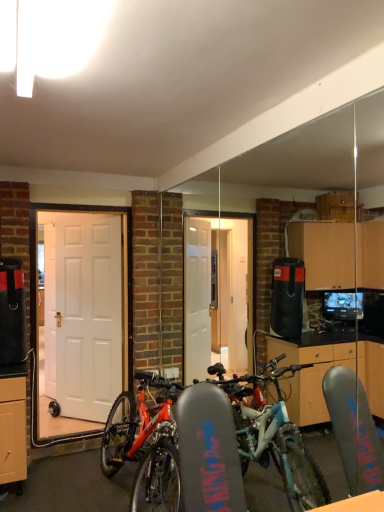
At what (x,y) coordinates should I click in order to perform the action: click on white matte door at left, the 1th door from the left. Please return your answer as a coordinate pair (x, y). Image resolution: width=384 pixels, height=512 pixels. Looking at the image, I should click on (50, 308).

Looking at this image, measure the distance between white matte door at left, the 1th door from the left, and camera.

Answer: They are 4.20 meters apart.

Image resolution: width=384 pixels, height=512 pixels. What do you see at coordinates (50, 308) in the screenshot?
I see `white matte door at left, the second door positioned from the right` at bounding box center [50, 308].

What is the approximate height of white glossy door at center, which ranks as the first door in right-to-left order?

2.00 meters.

Image resolution: width=384 pixels, height=512 pixels. What do you see at coordinates (87, 309) in the screenshot? I see `white glossy door at center, marked as the 1th door in a front-to-back arrangement` at bounding box center [87, 309].

In order to click on white glossy door at center, which ranks as the first door in right-to-left order in this screenshot , I will do `click(87, 309)`.

You are a GUI agent. You are given a task and a screenshot of the screen. Output one action in this format:
    pyautogui.click(x=<x>, y=<y>)
    Task: Click on the white matte door at left, the 1th door from the left
    Image resolution: width=384 pixels, height=512 pixels.
    Given the screenshot: What is the action you would take?
    50,308

Is white matte door at left, marked as the 2th door in a front-to-back arrangement, at the left side of white glossy door at center, the 2th door viewed from the back?

Yes.

Which object is further away from the camera taking this photo, white matte door at left, the second door positioned from the right, or white glossy door at center, the second door from the left?

white matte door at left, the second door positioned from the right.

Is point (51, 224) farther from camera compared to point (86, 378)?

Yes, it is behind point (86, 378).

From the image's perspective, is white matte door at left, marked as the 2th door in a front-to-back arrangement, above white glossy door at center, which ranks as the first door in right-to-left order?

No, from the image's perspective, white matte door at left, marked as the 2th door in a front-to-back arrangement, is not above white glossy door at center, which ranks as the first door in right-to-left order.

From a real-world perspective, is white matte door at left, arranged as the 1th door when viewed from the back, positioned above or below white glossy door at center, the second door from the left?

white matte door at left, arranged as the 1th door when viewed from the back, is situated lower than white glossy door at center, the second door from the left, in the real world.

Is white matte door at left, the second door positioned from the right, wider or thinner than white glossy door at center, marked as the 1th door in a front-to-back arrangement?

In the image, white matte door at left, the second door positioned from the right, appears to be more narrow than white glossy door at center, marked as the 1th door in a front-to-back arrangement.

Between white matte door at left, marked as the 2th door in a front-to-back arrangement, and white glossy door at center, the 2th door viewed from the back, which one has less height?

With less height is white matte door at left, marked as the 2th door in a front-to-back arrangement.

Based on their sizes in the image, would you say white matte door at left, the 1th door from the left, is bigger or smaller than white glossy door at center, the 2th door viewed from the back?

Clearly, white matte door at left, the 1th door from the left, is smaller in size than white glossy door at center, the 2th door viewed from the back.

Is white matte door at left, the 1th door from the left, located outside white glossy door at center, which ranks as the first door in right-to-left order?

Yes, white matte door at left, the 1th door from the left, is outside of white glossy door at center, which ranks as the first door in right-to-left order.

Is white matte door at left, the 1th door from the left, beside white glossy door at center, the second door from the left?

No, white matte door at left, the 1th door from the left, is not touching white glossy door at center, the second door from the left.

Is white matte door at left, arranged as the 1th door when viewed from the back, positioned with its back to white glossy door at center, which ranks as the first door in right-to-left order?

white matte door at left, arranged as the 1th door when viewed from the back, does not have its back to white glossy door at center, which ranks as the first door in right-to-left order.

How different are the orientations of white matte door at left, the second door positioned from the right, and white glossy door at center, the second door from the left, in degrees?

The angle between the facing direction of white matte door at left, the second door positioned from the right, and the facing direction of white glossy door at center, the second door from the left, is 15.6 degrees.

The width and height of the screenshot is (384, 512). Find the location of `door lying on the right of white matte door at left, marked as the 2th door in a front-to-back arrangement`. door lying on the right of white matte door at left, marked as the 2th door in a front-to-back arrangement is located at coordinates (87, 309).

Considering the positions of objects white glossy door at center, the second door from the left, and white matte door at left, the 1th door from the left, in the image provided, who is more to the right, white glossy door at center, the second door from the left, or white matte door at left, the 1th door from the left,?

white glossy door at center, the second door from the left, is more to the right.

Considering the positions of objects white glossy door at center, the second door from the left, and white matte door at left, arranged as the 1th door when viewed from the back, in the image provided, who is in front, white glossy door at center, the second door from the left, or white matte door at left, arranged as the 1th door when viewed from the back,?

Positioned in front is white glossy door at center, the second door from the left.

Is point (59, 382) closer or farther from the camera than point (44, 237)?

Point (59, 382) is closer to the camera than point (44, 237).

From the image's perspective, is white glossy door at center, which ranks as the first door in right-to-left order, above or below white matte door at left, marked as the 2th door in a front-to-back arrangement?

white glossy door at center, which ranks as the first door in right-to-left order, is situated higher than white matte door at left, marked as the 2th door in a front-to-back arrangement, in the image.

From a real-world perspective, is white glossy door at center, marked as the 1th door in a front-to-back arrangement, on top of white matte door at left, arranged as the 1th door when viewed from the back?

Yes, from a real-world perspective, white glossy door at center, marked as the 1th door in a front-to-back arrangement, is above white matte door at left, arranged as the 1th door when viewed from the back.

Can you confirm if white glossy door at center, which ranks as the first door in right-to-left order, is wider than white matte door at left, the second door positioned from the right?

Correct, the width of white glossy door at center, which ranks as the first door in right-to-left order, exceeds that of white matte door at left, the second door positioned from the right.

Who is shorter, white glossy door at center, marked as the 1th door in a front-to-back arrangement, or white matte door at left, arranged as the 1th door when viewed from the back?

white matte door at left, arranged as the 1th door when viewed from the back.

Considering the sizes of objects white glossy door at center, which ranks as the first door in right-to-left order, and white matte door at left, marked as the 2th door in a front-to-back arrangement, in the image provided, who is bigger, white glossy door at center, which ranks as the first door in right-to-left order, or white matte door at left, marked as the 2th door in a front-to-back arrangement,?

white glossy door at center, which ranks as the first door in right-to-left order.

Based on the photo, choose the correct answer: Is white glossy door at center, marked as the 1th door in a front-to-back arrangement, inside white matte door at left, the 1th door from the left, or outside it?

white glossy door at center, marked as the 1th door in a front-to-back arrangement, is spatially situated outside white matte door at left, the 1th door from the left.

Would you consider white glossy door at center, marked as the 1th door in a front-to-back arrangement, to be distant from white matte door at left, the second door positioned from the right?

No, there isn't a large distance between white glossy door at center, marked as the 1th door in a front-to-back arrangement, and white matte door at left, the second door positioned from the right.

Is white glossy door at center, the 2th door viewed from the back, oriented away from white matte door at left, the 1th door from the left?

white glossy door at center, the 2th door viewed from the back, is not turned away from white matte door at left, the 1th door from the left.

How different are the orientations of white glossy door at center, the second door from the left, and white matte door at left, arranged as the 1th door when viewed from the back, in degrees?

The facing directions of white glossy door at center, the second door from the left, and white matte door at left, arranged as the 1th door when viewed from the back, are 15.6 degrees apart.

At what (x,y) coordinates should I click in order to perform the action: click on door on the right of white matte door at left, the second door positioned from the right. Please return your answer as a coordinate pair (x, y). Looking at the image, I should click on (87, 309).

This screenshot has width=384, height=512. In the image, there is a white glossy door at center, which ranks as the first door in right-to-left order. What are the coordinates of `door below it (from a real-world perspective)` in the screenshot? It's located at (50, 308).

Image resolution: width=384 pixels, height=512 pixels. What are the coordinates of `door on the left of white glossy door at center, which ranks as the first door in right-to-left order` in the screenshot? It's located at (50, 308).